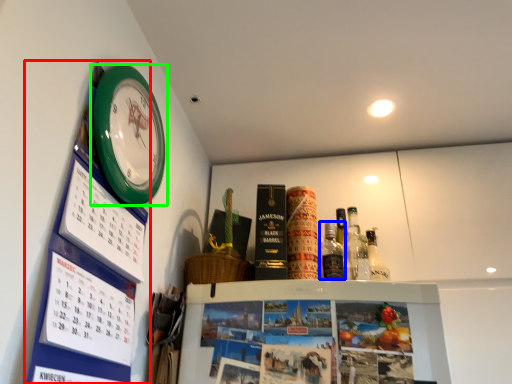
Question: Which is nearer to the bulletin board (highlighted by a red box)? bottle (highlighted by a blue box) or wall clock (highlighted by a green box).

Choices:
 (A) bottle
 (B) wall clock

Answer: (B)